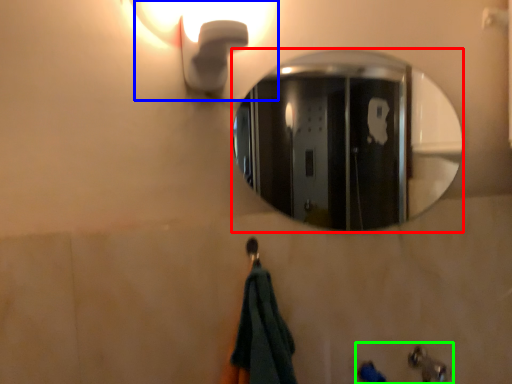
Question: Considering the real-world distances, which object is closest to mirror (highlighted by a red box)? light fixture (highlighted by a blue box) or sink (highlighted by a green box).

Choices:
 (A) light fixture
 (B) sink

Answer: (A)